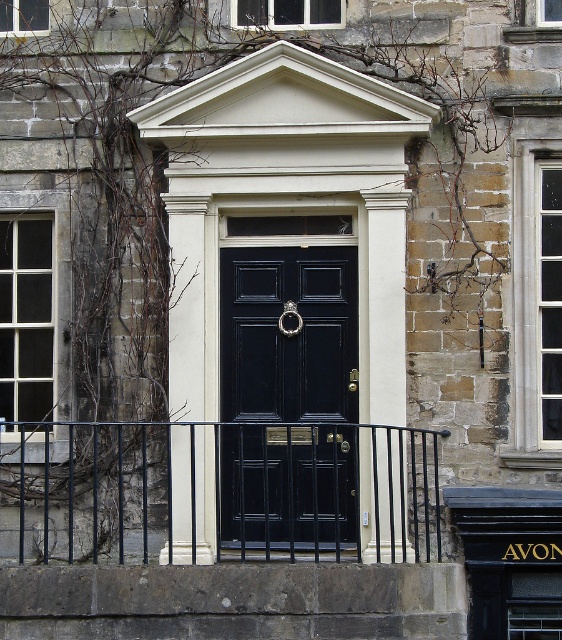
You are standing at the base of the staircase in front of the building and notice two features near the entrance. One is the black wrought iron at center and the other is the matte black door at center. From your perspective, which of these two items is located to the left of the other?

The black wrought iron at center is positioned on the left side of matte black door at center.

You are standing in front of the building entrance. There is a point marked at coordinates (220, 492). What object is located at that point?

The point at (220, 492) marks the location of the black wrought iron at center.